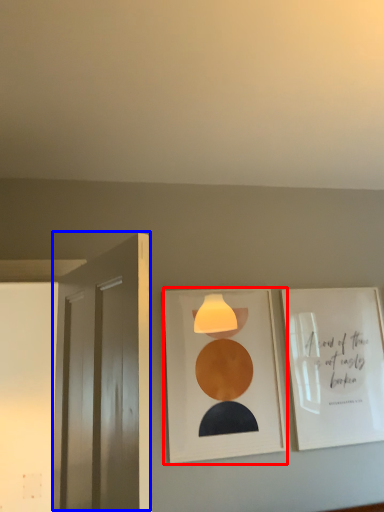
Question: Among these objects, which one is nearest to the camera, picture frame (highlighted by a red box) or door (highlighted by a blue box)?

Choices:
 (A) picture frame
 (B) door

Answer: (B)